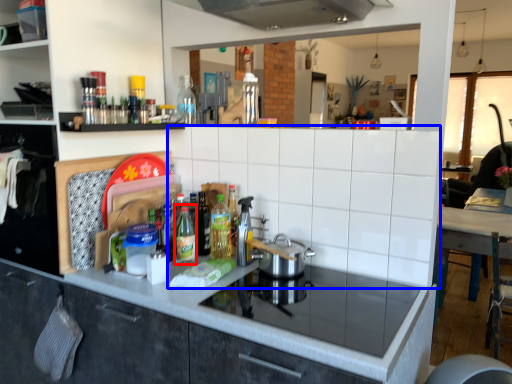
Question: Among these objects, which one is nearest to the camera, bottle (highlighted by a red box) or tile (highlighted by a blue box)?

Choices:
 (A) bottle
 (B) tile

Answer: (B)